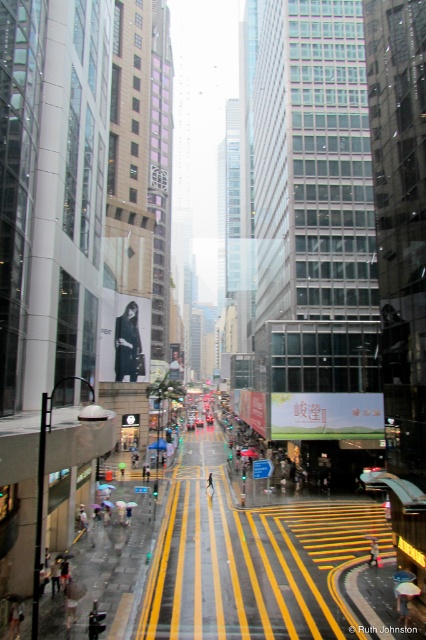
You are a delivery person trying to navigate through the busy street. You see a dark fabric coat at center and a raincoat fabric person at center. Which direction should you go to avoid both?

The dark fabric coat at center is positioned on the left side of raincoat fabric person at center, so you should go to the right side of both to avoid them.

You are a delivery person trying to cross the street quickly. You notice a dark fabric coat at center and a raincoat fabric person at center. Which one is wider and might block your path more?

The dark fabric coat at center might be wider than the raincoat fabric person at center, so it could block your path more.